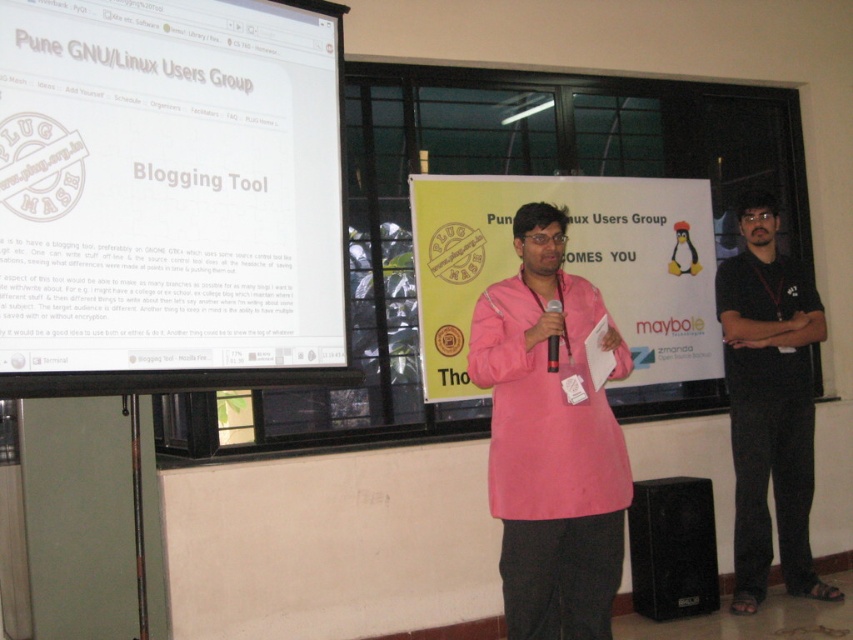
You are an event organizer who needs to arrange seating for the next panel discussion. The current setup has the pink fabric kurta at center and the black cotton shirt at right. Based on their positions, which side should you place the main microphone to ensure both speakers can access it comfortably?

The pink fabric kurta at center is to the left of the black cotton shirt at right. To ensure both speakers can access the main microphone comfortably, it should be placed centrally between them, equidistant from both positions.

You are an event organizer who needs to adjust the stage setup. The presenter is wearing a pink fabric kurta at center and holding a black matte microphone at center. Since the presenter is in front of the microphone, can you see the microphone from the audience perspective?

The pink fabric kurta at center is in front of the black matte microphone at center, so from the audience perspective, the microphone might be partially or fully blocked by the presenter.

From the picture: You are an attendee at the conference and need to take a photo of the presenter without blocking the screen. Can you position yourself so that the pink fabric kurta at center is fully visible behind the white glossy projector screen at upper left?

The white glossy projector screen at upper left is in front of the pink fabric kurta at center. Therefore, positioning yourself to capture the pink fabric kurta at center fully visible behind the white glossy projector screen at upper left would not be possible as the screen blocks the view of the kurta.